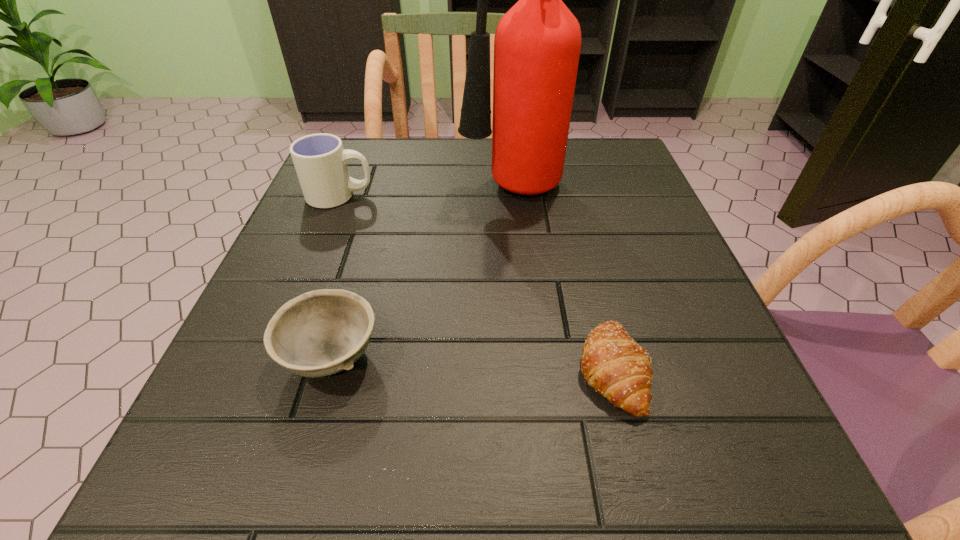
What are the coordinates of `free space at the far left corner of the desktop` in the screenshot? It's located at (394, 144).

Image resolution: width=960 pixels, height=540 pixels. I want to click on free point at the far right corner, so click(609, 153).

Where is `blank region between the cup and the tallest object`? blank region between the cup and the tallest object is located at coordinates (425, 194).

Image resolution: width=960 pixels, height=540 pixels. Find the location of `vacant point located between the crescent roll and the second tallest object`. vacant point located between the crescent roll and the second tallest object is located at coordinates (476, 282).

I want to click on unoccupied area between the tallest object and the third tallest object, so click(x=421, y=274).

At what (x,y) coordinates should I click in order to perform the action: click on free spot between the cup and the crescent roll. Please return your answer as a coordinate pair (x, y). Image resolution: width=960 pixels, height=540 pixels. Looking at the image, I should click on (476, 282).

Locate an element on the screen. This screenshot has height=540, width=960. free space between the second tallest object and the fire extinguisher is located at coordinates (425, 194).

The height and width of the screenshot is (540, 960). I want to click on free spot between the second shortest object and the tallest object, so click(x=421, y=274).

I want to click on empty location between the second shortest object and the shortest object, so click(x=472, y=363).

Find the location of `empty location between the second tallest object and the fire extinguisher`. empty location between the second tallest object and the fire extinguisher is located at coordinates (425, 194).